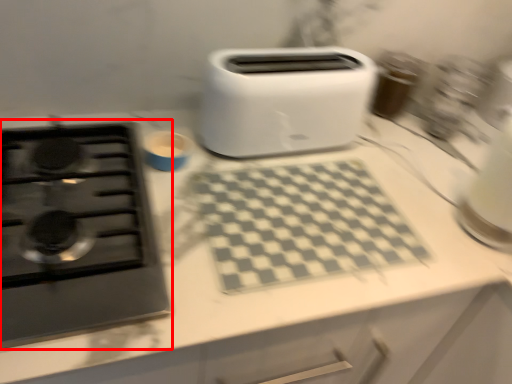
Question: Where is gas stove (annotated by the red box) located in relation to toaster in the image?

Choices:
 (A) left
 (B) right

Answer: (A)